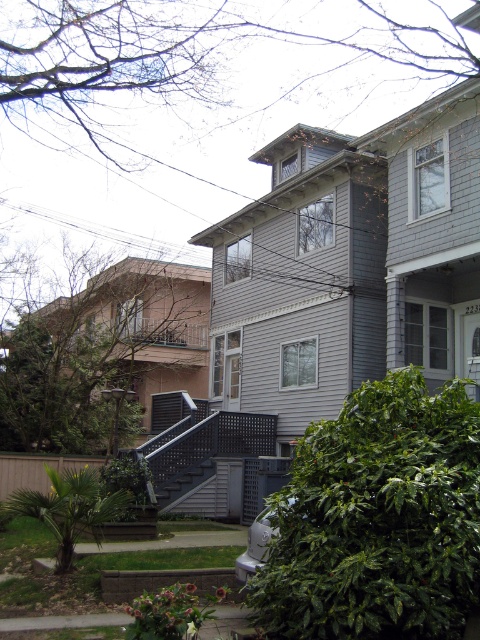
You are a delivery person trying to park your van next to the silver metallic car at lower center and the gray lattice stairs at center. Since your van is 2 meters wide, can you park it between them without overlapping?

The silver metallic car at lower center is narrower than the gray lattice stairs at center. Since the van is 2 meters wide, you need to check the available space between them. However, the exact distance isn

You are a delivery person arriving at house number 223. You need to park your silver metallic car at lower center and walk up the gray lattice stairs at center to deliver a package. Is your car blocking the stairs?

The silver metallic car at lower center is positioned on the right side of gray lattice stairs at center, so it is not blocking the stairs. You can park your car there and walk up the stairs without any obstruction.

You are a delivery person trying to park your van next to the gray lattice stairs at center. The van requires a space larger than the area taken by the silver metallic car at lower center. Can you park your van there?

The silver metallic car at lower center occupies less space than gray lattice stairs at center. Since the van needs a space larger than the car, the area next to the gray lattice stairs at center is suitable for parking the van.